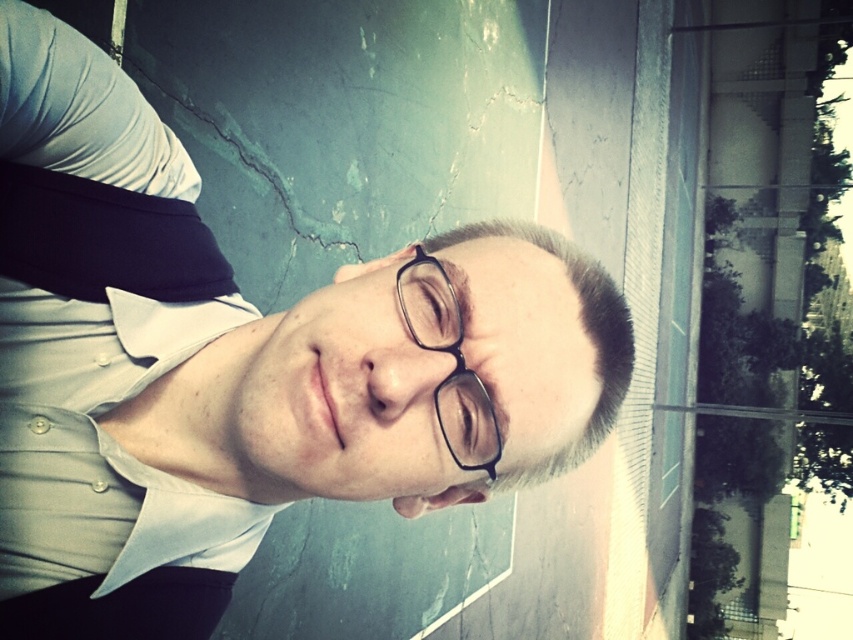
You are standing in the rotated image and want to find the white cotton dress shirt at center. According to the coordinates given, where should you look relative to the edges of the image?

The white cotton dress shirt at center is positioned at coordinates point (99, 352), which means it is located 55.0 percent from the left edge and 11.7 percent from the bottom edge of the image.

You are a photographer adjusting a camera to focus on the white shirt at center and the white cotton dress shirt at center in the rotated image. Which of the two shirts is positioned higher in the frame?

The white shirt at center is taller than the white cotton dress shirt at center, so it is positioned higher in the frame.